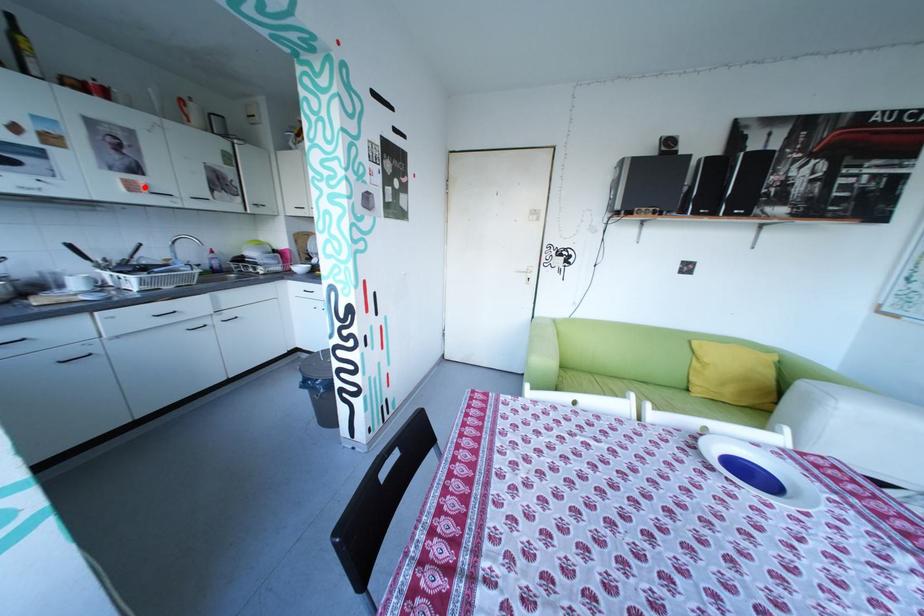
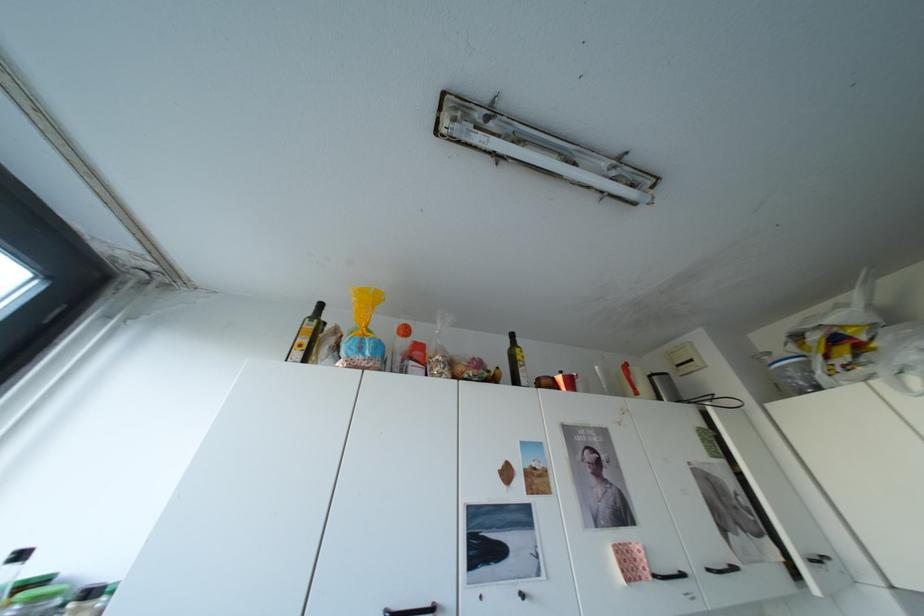
Locate, in the second image, the point that corresponds to the highlighted location in the first image.

(642, 568)